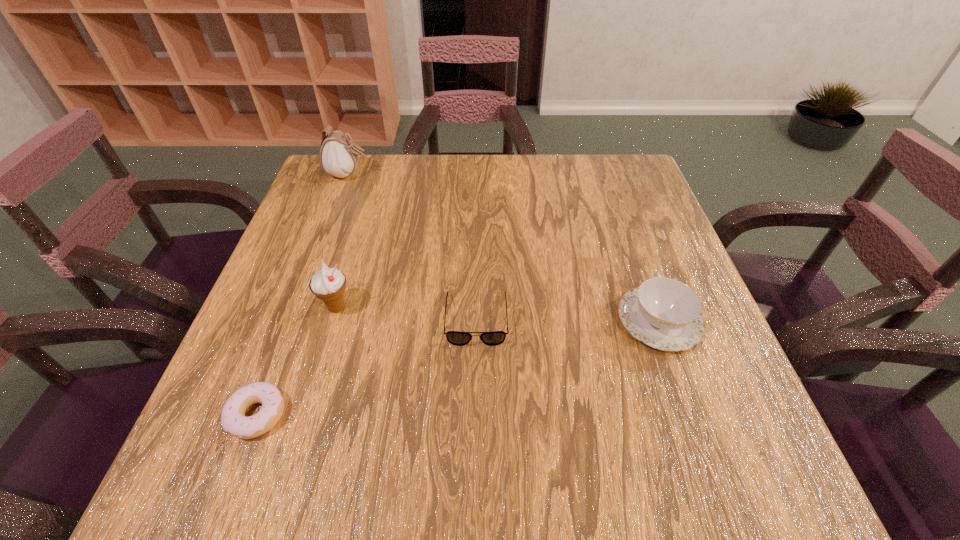
Locate an element on the screen. This screenshot has height=540, width=960. free space located 0.130m on the handle side of the rightmost object is located at coordinates (634, 249).

Find the location of `free spot located on the handle side of the rightmost object`. free spot located on the handle side of the rightmost object is located at coordinates (619, 207).

The height and width of the screenshot is (540, 960). Identify the location of vacant area situated on the front-facing side of the spectacles. (475, 410).

Identify the location of free region located 0.280m on the right of the nearest object. [x=452, y=415].

This screenshot has width=960, height=540. I want to click on object situated at the far edge, so click(339, 155).

Locate an element on the screen. The width and height of the screenshot is (960, 540). object located at the near edge is located at coordinates [x=233, y=419].

Locate an element on the screen. pouch located in the left edge section of the desktop is located at coordinates (339, 155).

The width and height of the screenshot is (960, 540). Identify the location of icecream present at the left edge. coord(328,284).

You are a GUI agent. You are given a task and a screenshot of the screen. Output one action in this format:
    pyautogui.click(x=<x>, y=<y>)
    Task: Click on the doughnut located at the left edge
    The height and width of the screenshot is (540, 960).
    Given the screenshot: What is the action you would take?
    pyautogui.click(x=233, y=419)

Locate an element on the screen. Image resolution: width=960 pixels, height=540 pixels. object at the right edge is located at coordinates (664, 313).